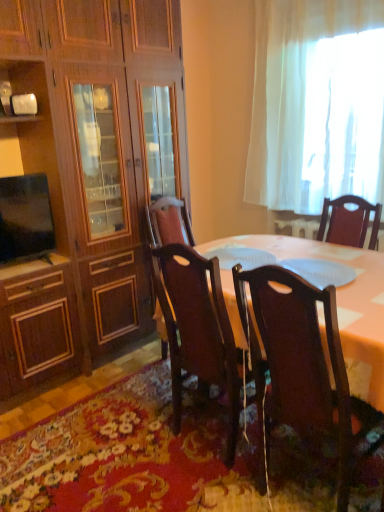
Question: Is point (187, 156) positioned closer to the camera than point (29, 250)?

Choices:
 (A) farther
 (B) closer

Answer: (A)

Question: From the image's perspective, is wooden cabinet at left above or below matte black tv at left?

Choices:
 (A) below
 (B) above

Answer: (B)

Question: Based on their relative distances, which object is nearer to the polished dark wood chair at center, the 1th chair viewed from the left?

Choices:
 (A) matte black tv at left
 (B) floral carpet at lower center
 (C) dark wood chair at lower right, the second chair positioned from the left
 (D) white sheer curtain at upper right
 (E) wooden cabinet at left

Answer: (C)

Question: Which of these objects is positioned farthest from the floral carpet at lower center?

Choices:
 (A) white sheer curtain at upper right
 (B) matte black tv at left
 (C) polished dark wood chair at center, the 1th chair viewed from the left
 (D) wooden cabinet at left
 (E) dark wood chair at lower right, the second chair positioned from the left

Answer: (A)